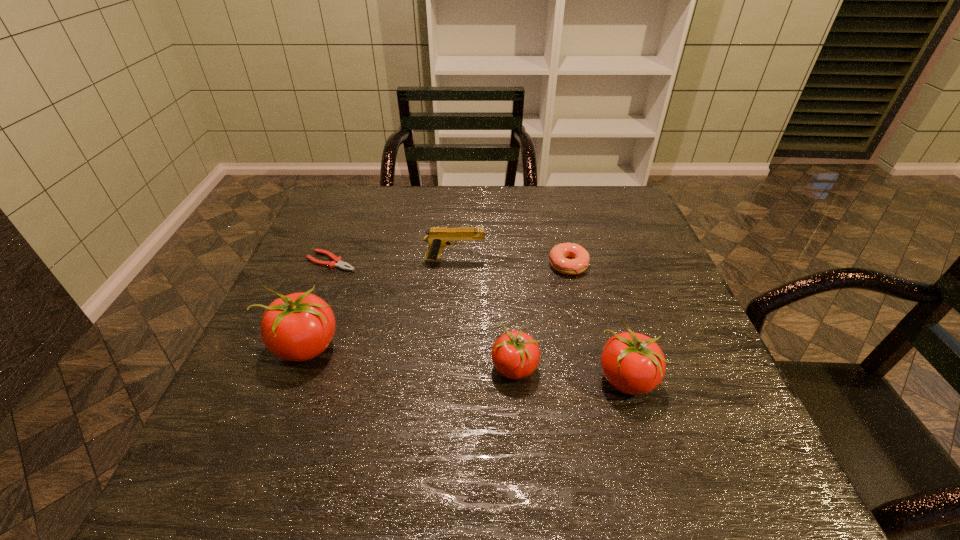
To achieve even spacing by inserting another tomato among them, please point to a vacant spot for this new tomato. Please provide its 2D coordinates. Your answer should be formatted as a tuple, i.e. [(x, y)], where the tuple contains the x and y coordinates of a point satisfying the conditions above.

[(408, 357)]